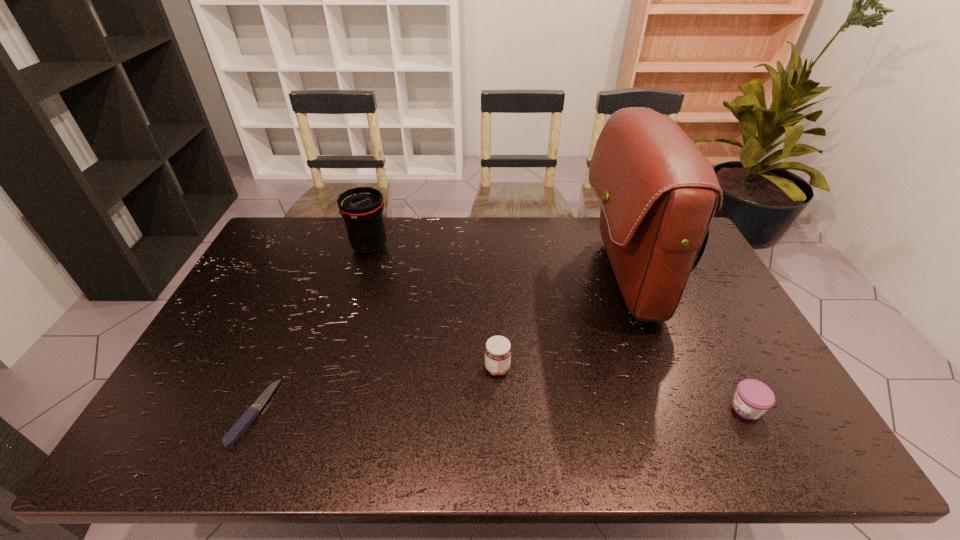
Where is `vacant space located 0.360m on the open flap of the second object from right to left`? The height and width of the screenshot is (540, 960). vacant space located 0.360m on the open flap of the second object from right to left is located at coordinates (473, 279).

Find the location of `vacant space positioned on the open flap of the second object from right to left`. vacant space positioned on the open flap of the second object from right to left is located at coordinates (516, 279).

At what (x,y) coordinates should I click in order to perform the action: click on vacant space located on the open flap of the second object from right to left. Please return your answer as a coordinate pair (x, y). This screenshot has width=960, height=540. Looking at the image, I should click on (516, 279).

This screenshot has width=960, height=540. I want to click on vacant space located 0.110m on the right of the telephoto lens, so click(421, 247).

Identify the location of free location located on the right of the third shortest object. The image size is (960, 540). (610, 368).

The height and width of the screenshot is (540, 960). Identify the location of vacant area located 0.320m on the front label of the rightmost object. (597, 408).

You are a GUI agent. You are given a task and a screenshot of the screen. Output one action in this format:
    pyautogui.click(x=<x>, y=<y>)
    Task: Click on the free point located 0.120m on the front label of the rightmost object
    The height and width of the screenshot is (540, 960).
    Given the screenshot: What is the action you would take?
    pyautogui.click(x=680, y=408)

Where is `blank space located on the front label of the rightmost object`? The width and height of the screenshot is (960, 540). blank space located on the front label of the rightmost object is located at coordinates (663, 408).

The image size is (960, 540). Identify the location of vacant position located 0.130m on the left of the steak knife. point(183,413).

In order to click on satchel present at the far edge in this screenshot , I will do `click(658, 192)`.